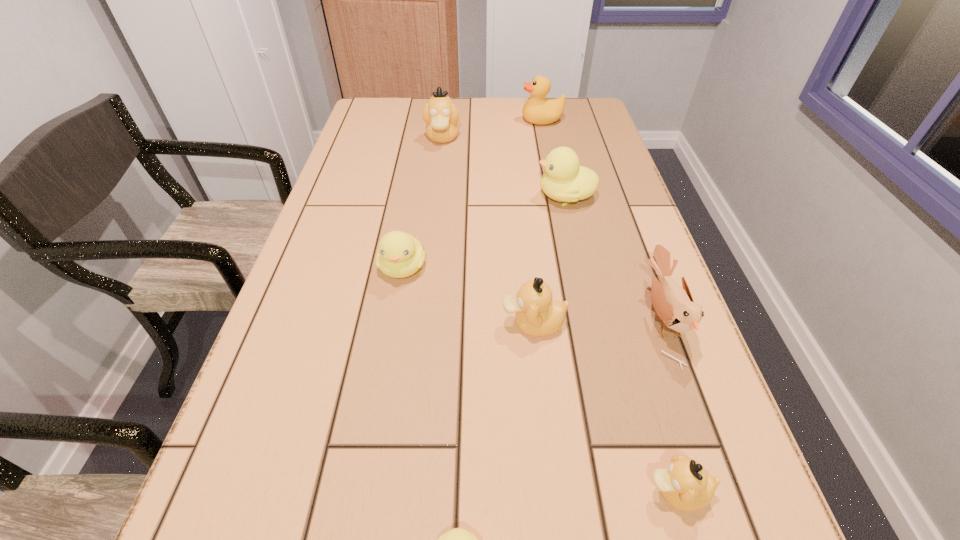
Locate an element on the screen. vacant point located between the rightmost yellow duckling and the bird is located at coordinates (613, 257).

You are a GUI agent. You are given a task and a screenshot of the screen. Output one action in this format:
    pyautogui.click(x=<x>, y=<y>)
    Task: Click on the free space between the second tan duckling from right to left and the smallest tan duckling
    
    Given the screenshot: What is the action you would take?
    pyautogui.click(x=605, y=408)

The height and width of the screenshot is (540, 960). In order to click on free spot between the second farthest yellow duckling and the smallest tan duckling in this screenshot , I will do `click(540, 380)`.

At what (x,y) coordinates should I click in order to perform the action: click on vacant area that lies between the bird and the second nearest tan duckling. Please return your answer as a coordinate pair (x, y). The image size is (960, 540). Looking at the image, I should click on (597, 321).

Identify the location of free point between the bird and the biggest yellow duckling. This screenshot has width=960, height=540. (613, 257).

The height and width of the screenshot is (540, 960). In order to click on free space between the smallest tan duckling and the second smallest tan duckling in this screenshot , I will do `click(605, 408)`.

Where is `object that is the sixth closest to the leftmost yellow duckling`? object that is the sixth closest to the leftmost yellow duckling is located at coordinates (685, 485).

Identify which object is located as the fifth nearest to the seventh farthest object. Please provide its 2D coordinates. Your answer should be formatted as a tuple, i.e. [(x, y)], where the tuple contains the x and y coordinates of a point satisfying the conditions above.

[(564, 180)]

Identify the location of duckling that is the fourth closest to the nearest yellow duckling. (564, 180).

This screenshot has height=540, width=960. In order to click on duckling that stands as the closest to the shortest duckling in this screenshot , I will do `click(685, 485)`.